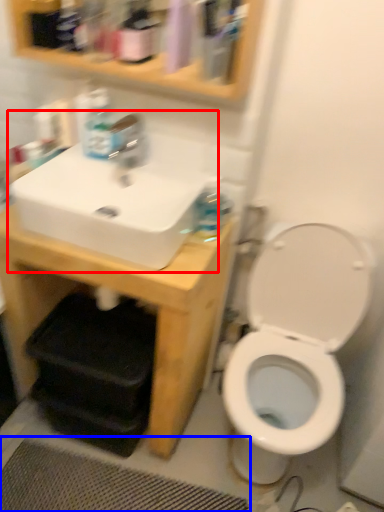
Question: Which point is further to the camera, sink (highlighted by a red box) or bath mat (highlighted by a blue box)?

Choices:
 (A) sink
 (B) bath mat

Answer: (B)